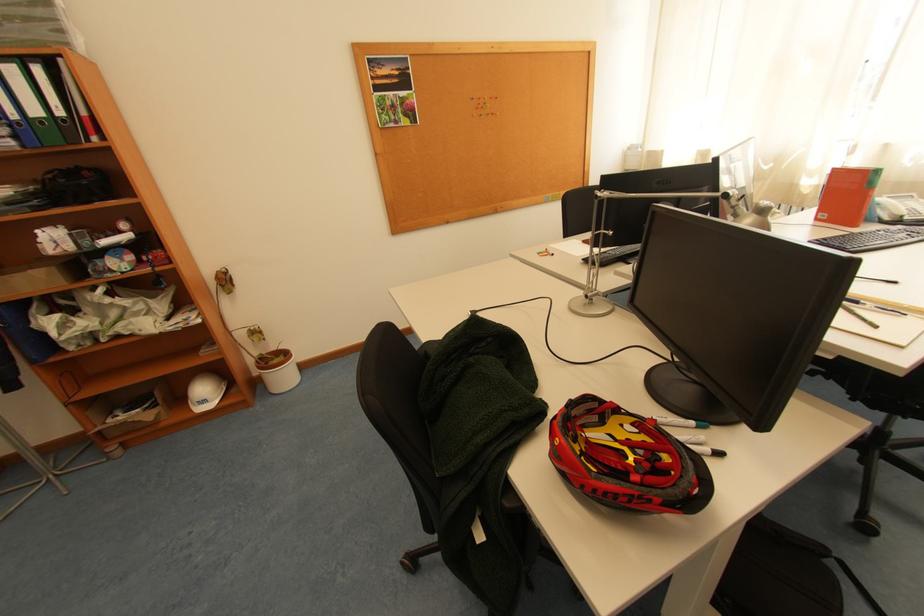
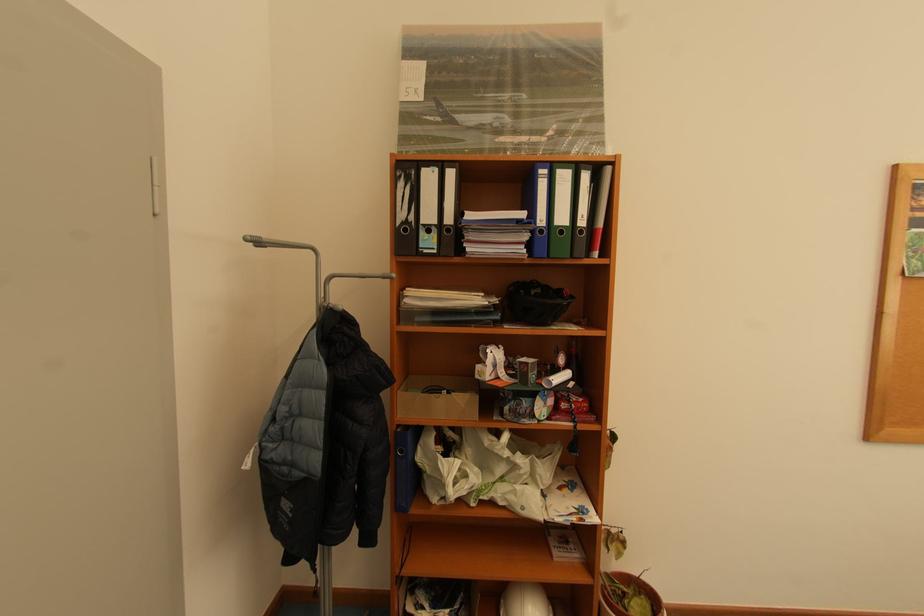
The point at (270, 355) is marked in the first image. Where is the corresponding point in the second image?

(614, 576)